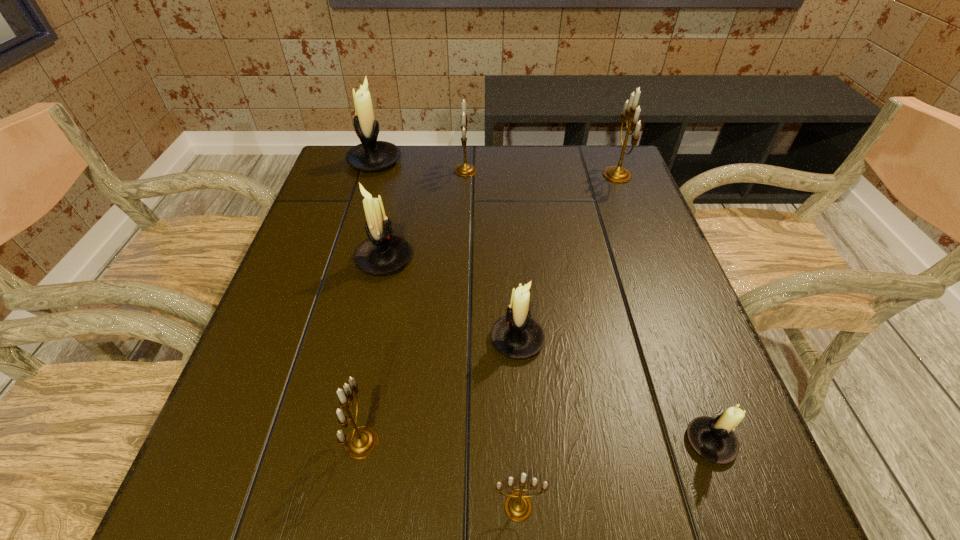
Identify the location of the biggest white candle holder. (370, 155).

You are a GUI agent. You are given a task and a screenshot of the screen. Output one action in this format:
    pyautogui.click(x=<x>, y=<y>)
    Task: Click on the biggest gold candelabrum
    
    Given the screenshot: What is the action you would take?
    pyautogui.click(x=617, y=174)

Find the location of `the third nearest white candle holder`. the third nearest white candle holder is located at coordinates (382, 253).

The image size is (960, 540). I want to click on the fourth farthest candelabrum, so click(382, 253).

Find the location of `the fifth object from right to left`. the fifth object from right to left is located at coordinates (465, 169).

Find the location of `the second gold candelabrum from left to right`. the second gold candelabrum from left to right is located at coordinates point(465,169).

You are a GUI agent. You are given a task and a screenshot of the screen. Output one action in this format:
    pyautogui.click(x=<x>, y=<y>)
    Task: Click on the fourth nearest candelabrum
    
    Given the screenshot: What is the action you would take?
    pyautogui.click(x=517, y=335)

Where is `the third farthest white candle holder`? The height and width of the screenshot is (540, 960). the third farthest white candle holder is located at coordinates (517, 335).

Where is `the third farthest gold candelabrum`? This screenshot has width=960, height=540. the third farthest gold candelabrum is located at coordinates (361, 442).

Find the location of `the leftmost gold candelabrum`. the leftmost gold candelabrum is located at coordinates (361, 442).